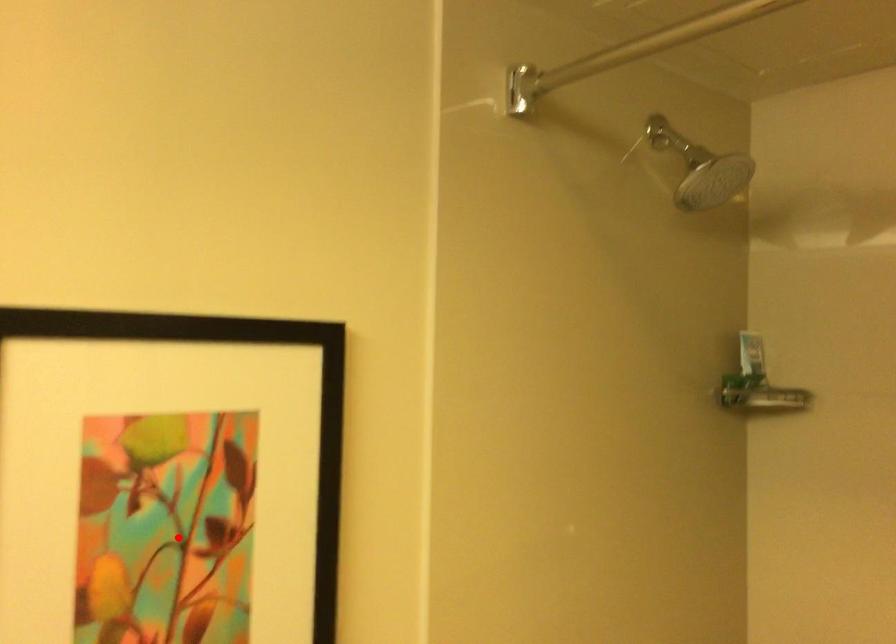
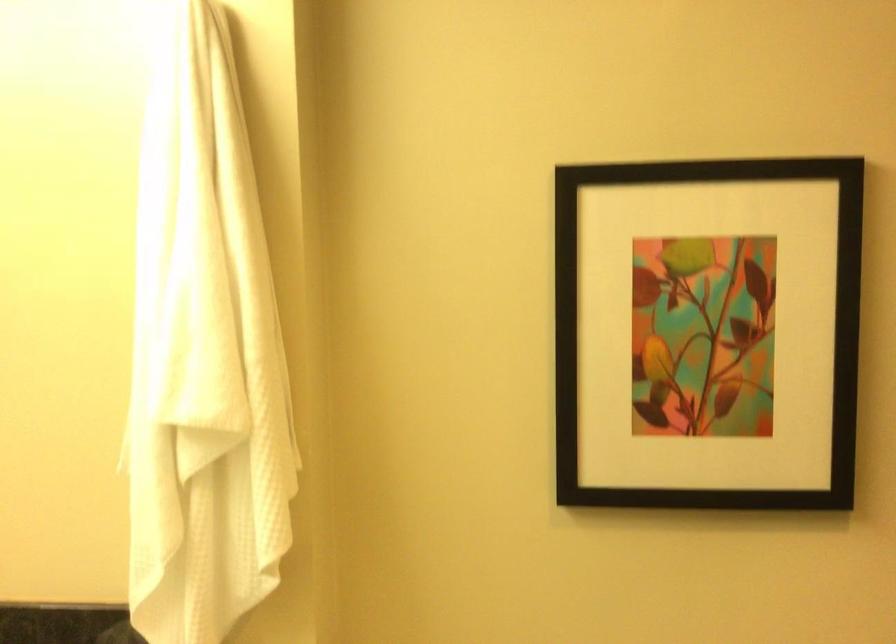
Question: A red point is marked in image1. In image2, is the corresponding 3D point closer to the camera or farther? Reply with the corresponding letter.

Choices:
 (A) The corresponding 3D point is closer.
 (B) The corresponding 3D point is farther.

Answer: (B)